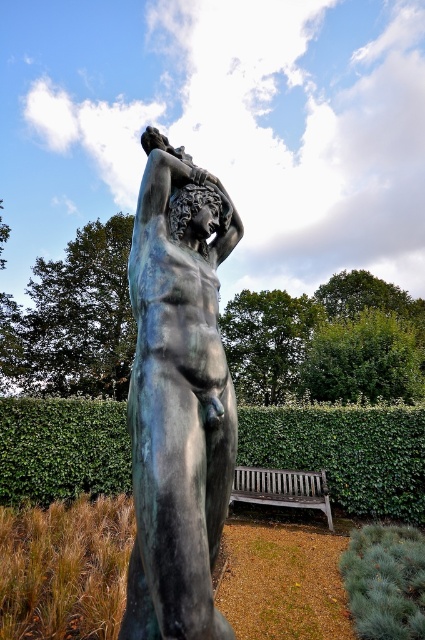
Can you confirm if green leafy hedge at center is taller than wooden bench at lower center?

Indeed, green leafy hedge at center has a greater height compared to wooden bench at lower center.

Is point (405, 509) farther from viewer compared to point (300, 476)?

No.

Does point (377, 467) lie in front of point (319, 483)?

That is False.

The height and width of the screenshot is (640, 425). What are the coordinates of `green leafy hedge at center` in the screenshot? It's located at (345, 452).

Who is positioned more to the right, bronze statue at center or wooden bench at lower center?

wooden bench at lower center

Does point (201, 394) lie in front of point (314, 481)?

Yes, point (201, 394) is in front of point (314, 481).

Which is behind, point (172, 152) or point (263, 477)?

The point (263, 477) is more distant.

Where is `bronze statue at center`? The image size is (425, 640). bronze statue at center is located at coordinates (178, 397).

Is bronze statue at center below green leafy hedge at center?

No.

Does bronze statue at center appear on the right side of green leafy hedge at center?

Yes, bronze statue at center is to the right of green leafy hedge at center.

What are the coordinates of `bronze statue at center` in the screenshot? It's located at (178, 397).